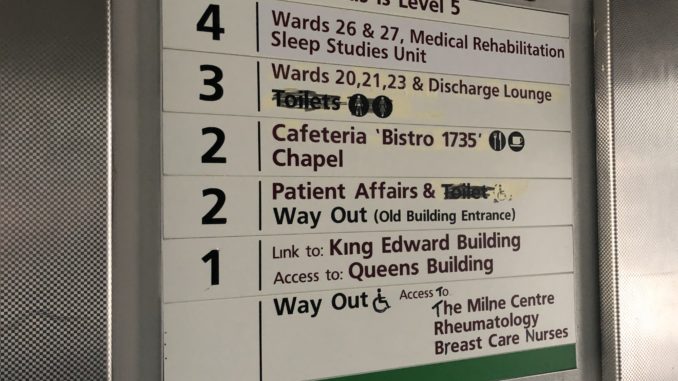
Identify the location of silver wall. This screenshot has height=381, width=678. (649, 188), (62, 155).